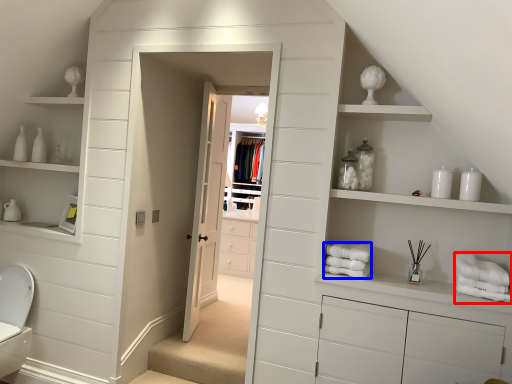
Question: Which point is further to the camera, bath towel (highlighted by a red box) or bath towel (highlighted by a blue box)?

Choices:
 (A) bath towel
 (B) bath towel

Answer: (B)